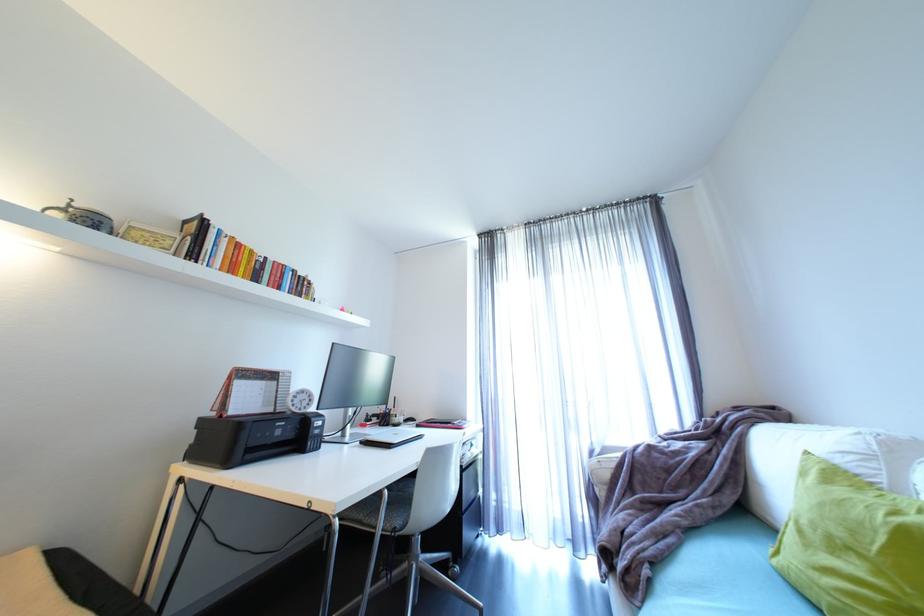
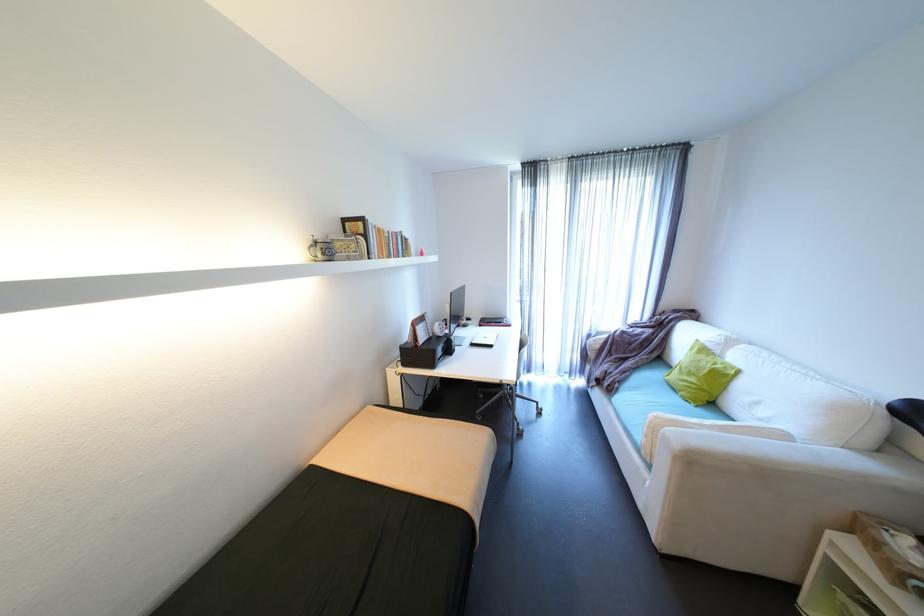
Locate, in the second image, the point that corresponds to (341,344) in the first image.

(458, 294)